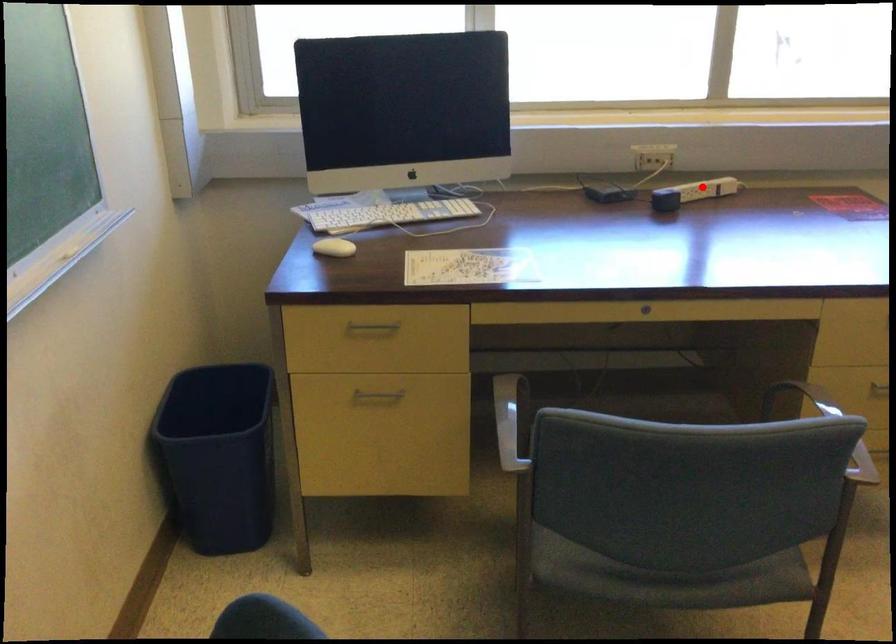
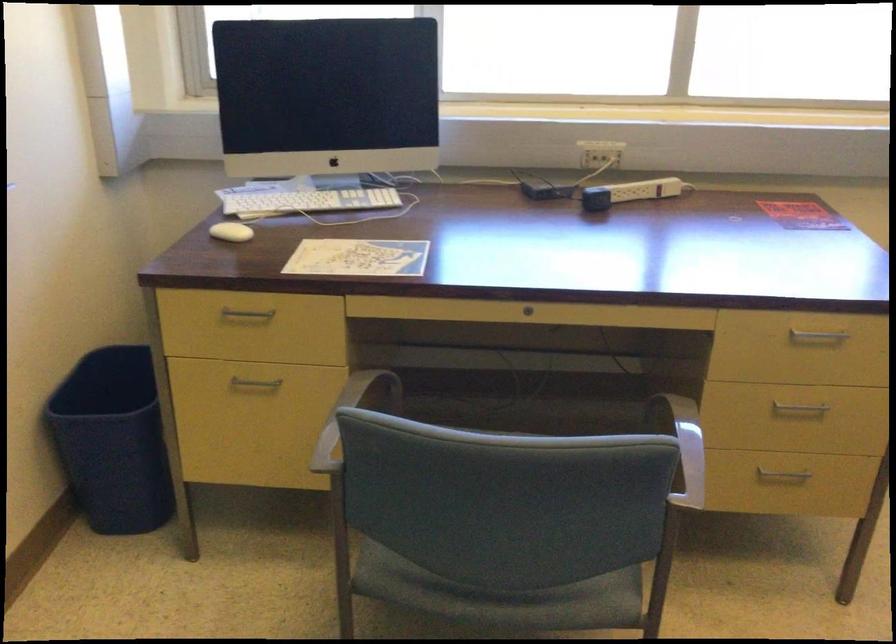
The point at the highlighted location is marked in the first image. Where is the corresponding point in the second image?

(642, 190)